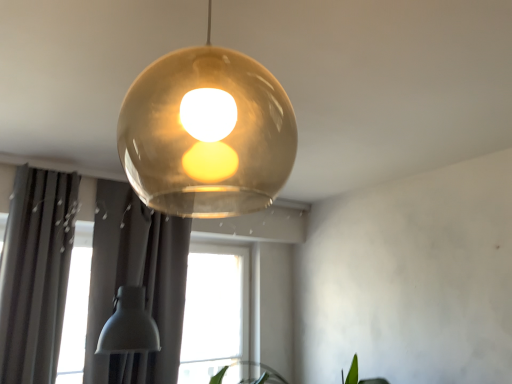
Question: Looking at the image, does dark gray fabric curtain at left, arranged as the 1th curtain when viewed from the left, seem bigger or smaller compared to green leafy plant at lower right?

Choices:
 (A) big
 (B) small

Answer: (B)

Question: In terms of height, does dark gray fabric curtain at left, arranged as the 1th curtain when viewed from the left, look taller or shorter compared to green leafy plant at lower right?

Choices:
 (A) short
 (B) tall

Answer: (B)

Question: Based on their relative distances, which object is farther from the green leafy plant at lower right?

Choices:
 (A) translucent amber sphere at center
 (B) matte gray curtain at lower left, the 2th curtain from the left
 (C) dark gray fabric curtain at left, marked as the 2th curtain in a right-to-left arrangement

Answer: (C)

Question: Which object is positioned closest to the matte gray curtain at lower left, the 1th curtain from the right?

Choices:
 (A) dark gray fabric curtain at left, arranged as the 1th curtain when viewed from the left
 (B) green leafy plant at lower right
 (C) translucent amber sphere at center

Answer: (A)